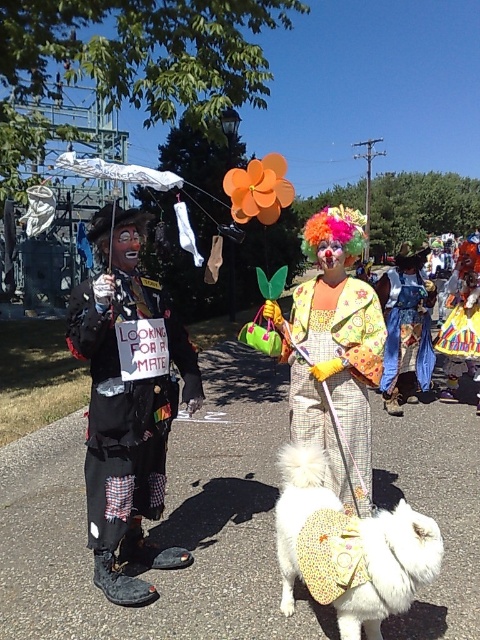
You are standing at the center of the scene. Which direction should you look to see the black leather outfit at left?

Since the black leather outfit at left is located at point [127,404], you should look to your left to see it.

You are a photographer at the festival and want to capture both the black leather outfit at left and the denim dress at center in a single shot. Based on their positions, which one should you focus on first to ensure both are in frame?

Since the black leather outfit at left is below the denim dress at center, you should focus on the denim dress at center first to ensure both are in frame.